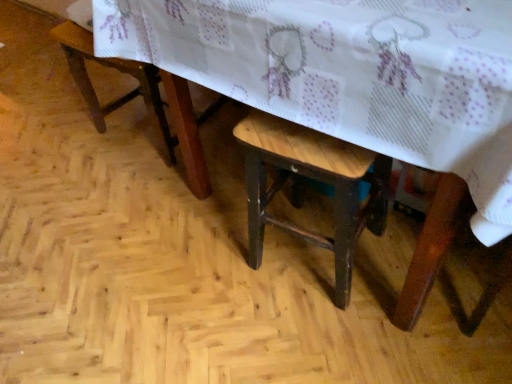
You are a GUI agent. You are given a task and a screenshot of the screen. Output one action in this format:
    pyautogui.click(x=<x>, y=<y>)
    Task: Click on the vacant space in front of wooden stool at center
    This screenshot has width=512, height=384.
    Given the screenshot: What is the action you would take?
    pyautogui.click(x=326, y=336)